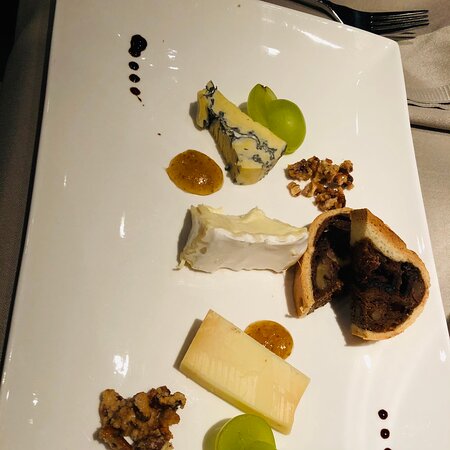
Identify the location of napkin. This screenshot has width=450, height=450. (428, 86).